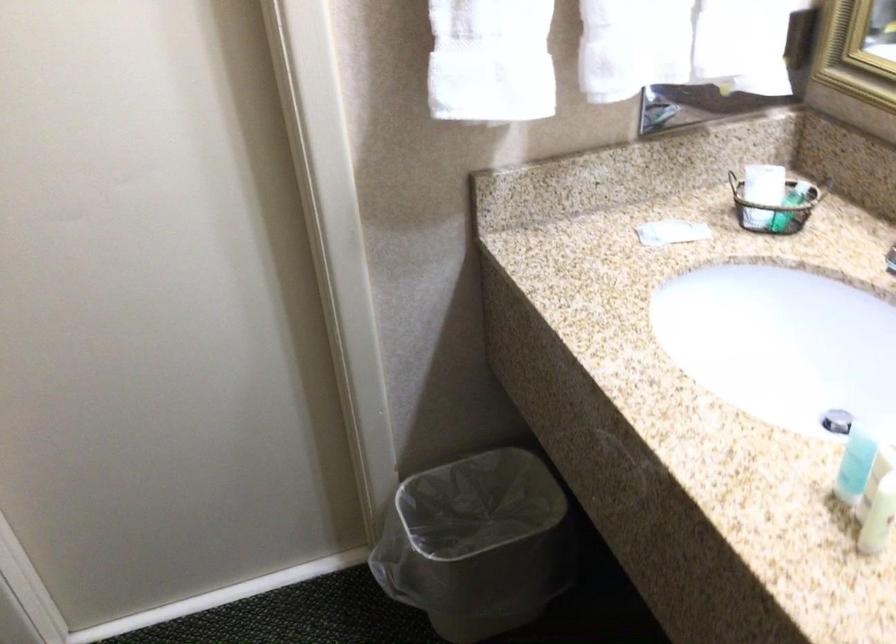
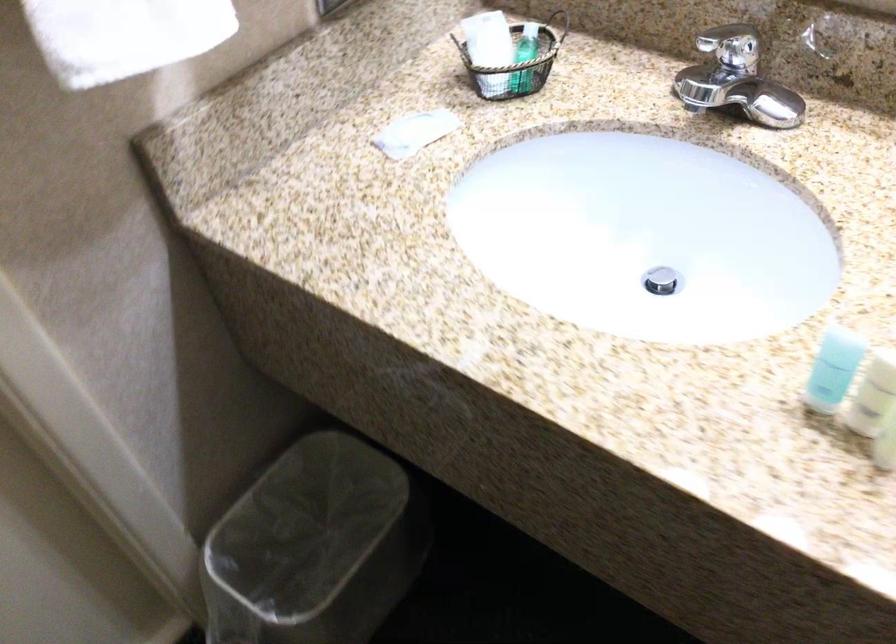
The point at (x=771, y=204) is marked in the first image. Where is the corresponding point in the second image?

(515, 64)